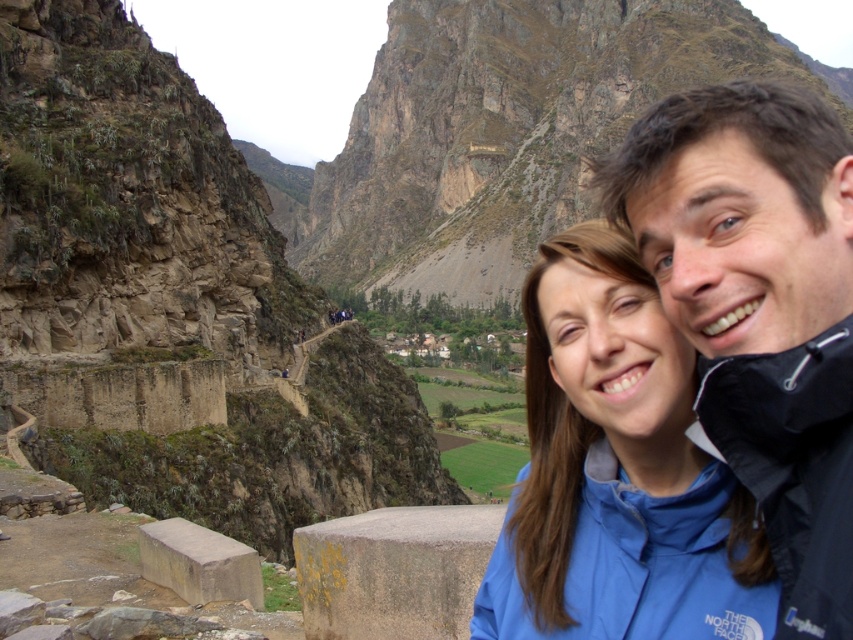
Can you confirm if blue fabric jacket at center is taller than dark blue nylon jacket at upper right?

Yes.

Does point (701, 564) come farther from viewer compared to point (851, 396)?

Yes, point (701, 564) is behind point (851, 396).

This screenshot has height=640, width=853. Identify the location of blue fabric jacket at center. (616, 472).

In order to click on blue fabric jacket at center in this screenshot , I will do `click(616, 472)`.

Does blue fabric jacket at right have a greater width compared to blue fabric jacket at center?

No.

From the picture: Is blue fabric jacket at right below blue fabric jacket at center?

No.

Where is `blue fabric jacket at right`? This screenshot has height=640, width=853. blue fabric jacket at right is located at coordinates (759, 308).

I want to click on blue fabric jacket at right, so click(x=759, y=308).

Is rugged stone mountain at upper center above blue fabric jacket at center?

Correct, rugged stone mountain at upper center is located above blue fabric jacket at center.

Can you confirm if rugged stone mountain at upper center is bigger than blue fabric jacket at center?

Yes, rugged stone mountain at upper center is bigger than blue fabric jacket at center.

Locate an element on the screen. The image size is (853, 640). rugged stone mountain at upper center is located at coordinates (503, 129).